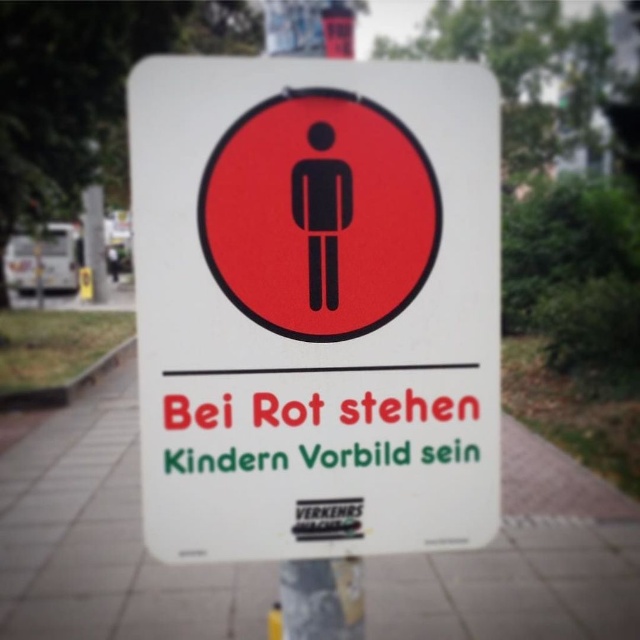
Is white plastic sign at center taller than white concrete pavement at center?

Yes, white plastic sign at center is taller than white concrete pavement at center.

Can you confirm if white plastic sign at center is positioned to the left of white concrete pavement at center?

No, white plastic sign at center is not to the left of white concrete pavement at center.

The image size is (640, 640). I want to click on white plastic sign at center, so click(316, 305).